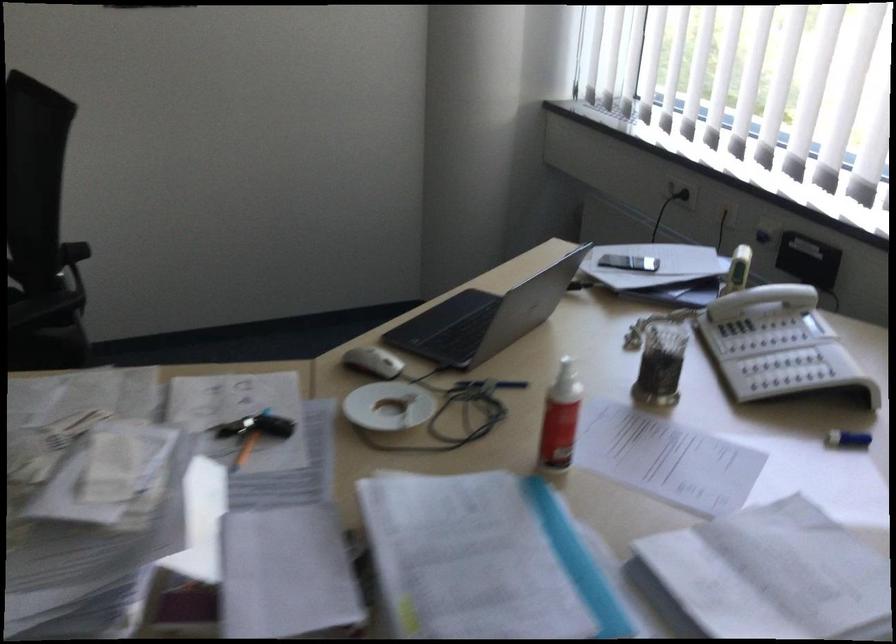
The image size is (896, 644). Find the location of `small hammer`. small hammer is located at coordinates (255, 426).